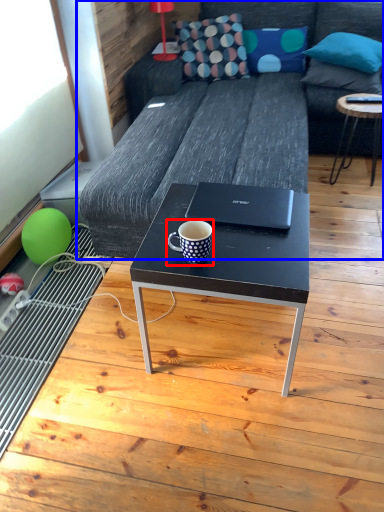
Question: Which object is closer to the camera taking this photo, coffee cup (highlighted by a red box) or studio couch (highlighted by a blue box)?

Choices:
 (A) coffee cup
 (B) studio couch

Answer: (A)